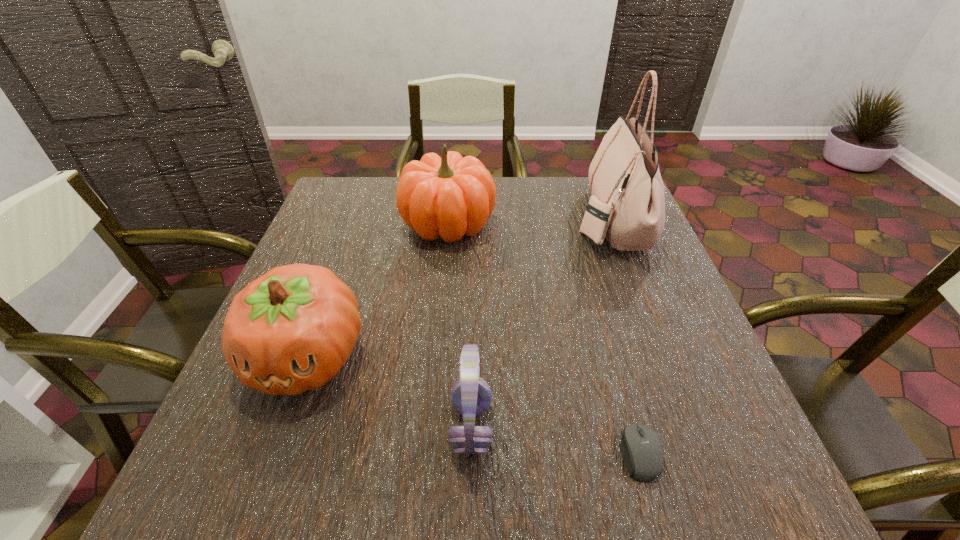
The width and height of the screenshot is (960, 540). I want to click on free space that satisfies the following two spatial constraints: 1. on the headband and ear cups of the headset; 2. on the right side of the shortest object, so click(x=470, y=453).

Find the location of a particular element. vacant space that satisfies the following two spatial constraints: 1. on the headband and ear cups of the shortest object; 2. on the right side of the headset is located at coordinates (470, 453).

Where is `free region that satisfies the following two spatial constraints: 1. on the side of the shortest object with the cute face; 2. on the right side of the nearer pumpkin`? free region that satisfies the following two spatial constraints: 1. on the side of the shortest object with the cute face; 2. on the right side of the nearer pumpkin is located at coordinates (273, 453).